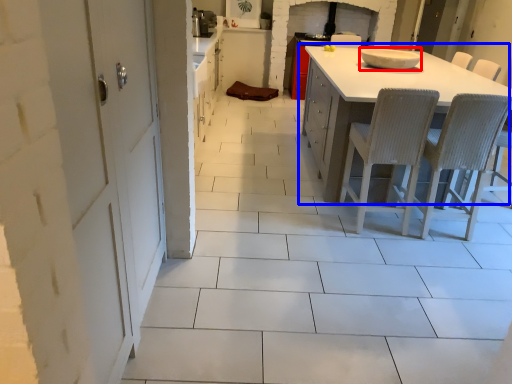
Question: Which of the following is the farthest to the observer, appliance (highlighted by a red box) or table (highlighted by a blue box)?

Choices:
 (A) appliance
 (B) table

Answer: (A)